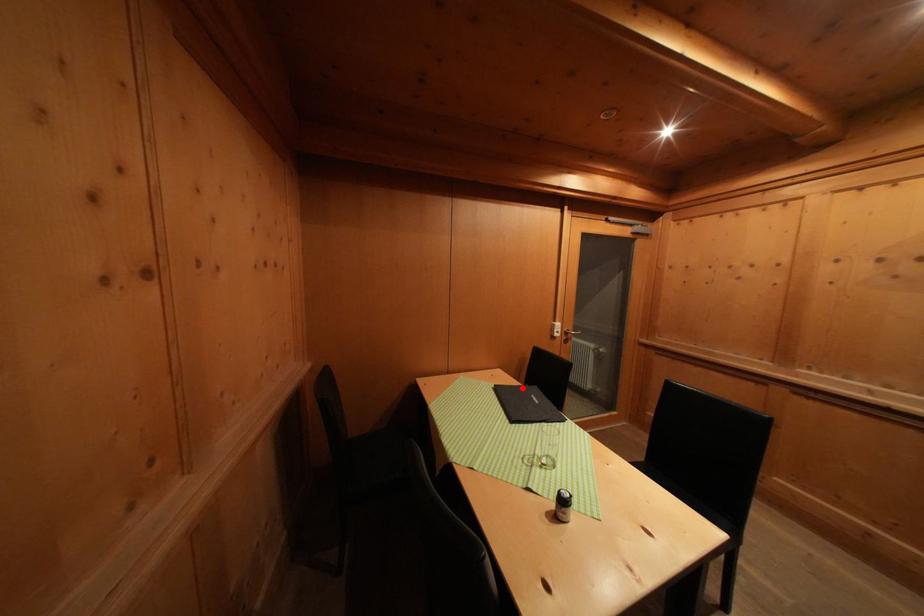
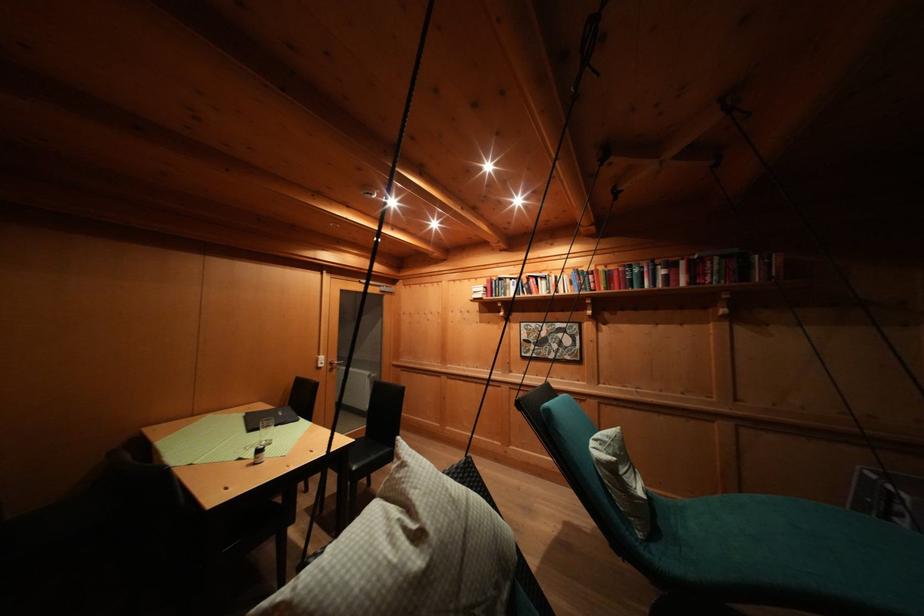
Question: I am providing you with two images of the same scene from different viewpoints. A red point is shown in image1. For the corresponding object point in image2, is it positioned nearer or farther from the camera?

Choices:
 (A) Nearer
 (B) Farther

Answer: (B)